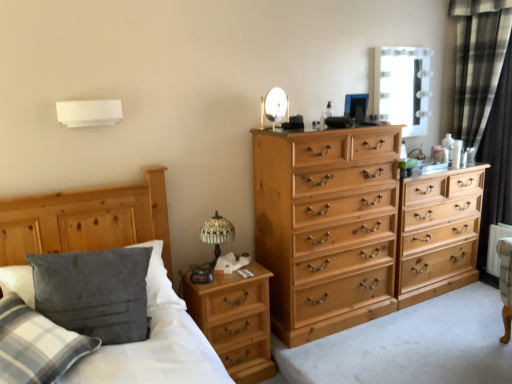
Question: Visually, is metallic round mirror at upper center positioned to the left or to the right of white glossy mirror at upper right?

Choices:
 (A) left
 (B) right

Answer: (A)

Question: Is metallic round mirror at upper center taller or shorter than white glossy mirror at upper right?

Choices:
 (A) short
 (B) tall

Answer: (A)

Question: Estimate the real-world distances between objects in this image. Which object is closer to the natural wood chest of drawers at right, arranged as the second chest of drawers when viewed from the left?

Choices:
 (A) wooden bed frame at left
 (B) wooden nightstand at lower left
 (C) white glossy mirror at upper right
 (D) natural wood chest of drawers at center, which is the 1th chest of drawers from left to right
 (E) velvety gray pillow at lower left

Answer: (D)

Question: Which is nearer to the black plaid curtain at right?

Choices:
 (A) stained glass table lamp at center left
 (B) velvety gray pillow at lower left
 (C) wooden nightstand at lower left
 (D) wooden bed frame at left
 (E) natural wood chest of drawers at center, which is the 1th chest of drawers from left to right

Answer: (E)